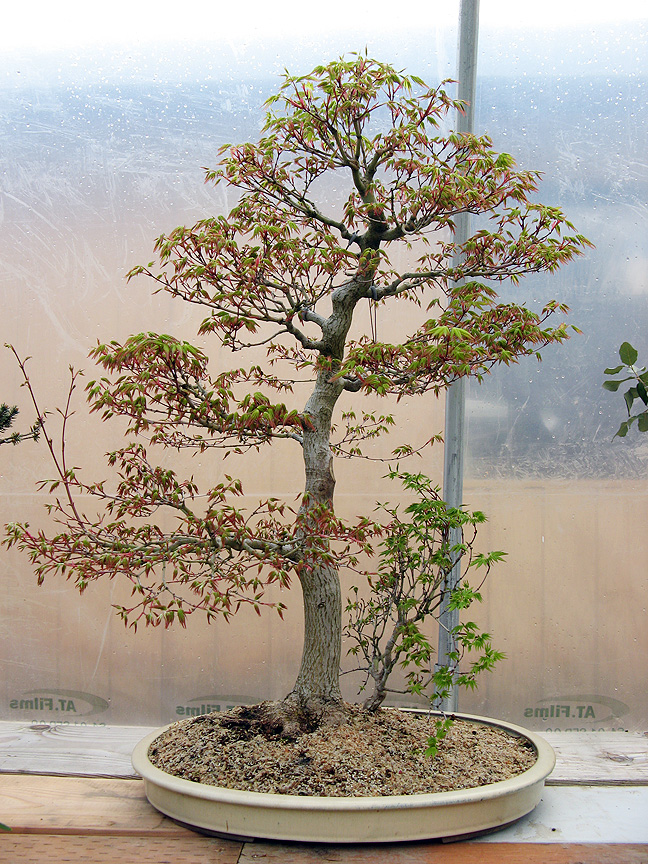
Image resolution: width=648 pixels, height=864 pixels. What are the coordinates of `round flat planter dish for tree, bottom center` in the screenshot? It's located at (496, 801), (388, 824), (269, 817), (165, 790).